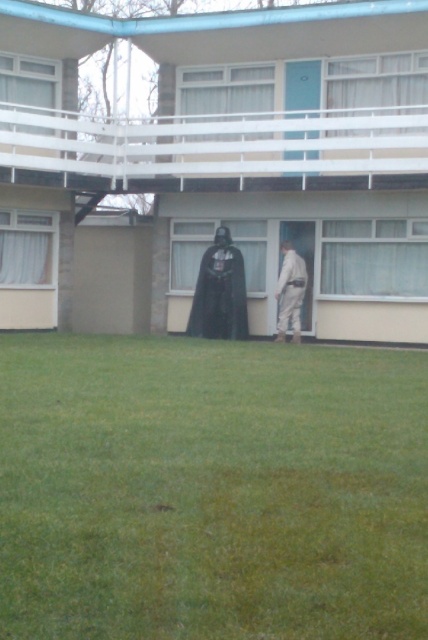
You are a photographer trying to capture a shot of the green grass at lower center and the black matte cloak at center. Which object should you adjust your camera to focus on first if you want to include both in the frame without moving the camera?

The green grass at lower center is positioned on the left side of the black matte cloak at center, so you should focus on the black matte cloak at center first to ensure both objects are within the frame.

You are standing at the point with coordinates point (219, 292). What object are you standing on?

You are standing on the black matte cloak at center.

You are a fashion designer observing the Darth Vader costume. You need to determine if the black matte cloak at center is covering any part of the white fabric pants at lower center. Based on the scene, what do you observe?

The black matte cloak at center is positioned over white fabric pants at lower center, so yes, the cloak is covering part of the pants.